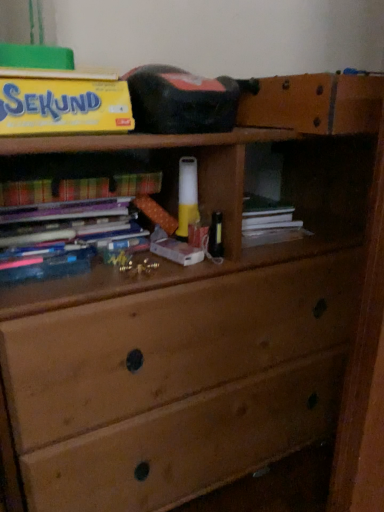
Question: Considering the relative positions of multicolored paper book at left and yellow matte paper at upper left in the image provided, is multicolored paper book at left to the left of yellow matte paper at upper left from the viewer's perspective?

Choices:
 (A) no
 (B) yes

Answer: (A)

Question: From a real-world perspective, is multicolored paper book at left beneath yellow matte paper at upper left?

Choices:
 (A) no
 (B) yes

Answer: (B)

Question: Are multicolored paper book at left and yellow matte paper at upper left far apart?

Choices:
 (A) yes
 (B) no

Answer: (B)

Question: Does multicolored paper book at left have a larger size compared to yellow matte paper at upper left?

Choices:
 (A) no
 (B) yes

Answer: (A)

Question: Is multicolored paper book at left touching yellow matte paper at upper left?

Choices:
 (A) no
 (B) yes

Answer: (A)

Question: Does multicolored paper book at left have a smaller size compared to yellow matte paper at upper left?

Choices:
 (A) yes
 (B) no

Answer: (A)

Question: Considering the relative positions of yellow matte paper at upper left and multicolored paper book at left in the image provided, is yellow matte paper at upper left behind multicolored paper book at left?

Choices:
 (A) no
 (B) yes

Answer: (A)

Question: Is yellow matte paper at upper left far from multicolored paper book at left?

Choices:
 (A) no
 (B) yes

Answer: (A)

Question: Is multicolored paper book at left surrounded by yellow matte paper at upper left?

Choices:
 (A) no
 (B) yes

Answer: (A)

Question: Can you see yellow matte paper at upper left touching multicolored paper book at left?

Choices:
 (A) no
 (B) yes

Answer: (A)

Question: Is the depth of yellow matte paper at upper left less than that of multicolored paper book at left?

Choices:
 (A) no
 (B) yes

Answer: (B)

Question: Does yellow matte paper at upper left have a greater width compared to multicolored paper book at left?

Choices:
 (A) no
 (B) yes

Answer: (B)

Question: In terms of height, does multicolored paper book at left look taller or shorter compared to yellow matte paper at upper left?

Choices:
 (A) short
 (B) tall

Answer: (A)